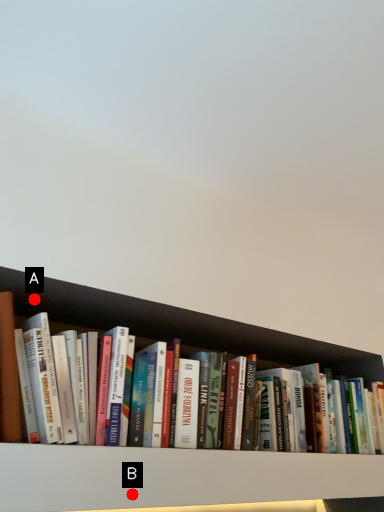
Question: Two points are circled on the image, labeled by A and B beside each circle. Which of the following is the closest to the observer?

Choices:
 (A) A is closer
 (B) B is closer

Answer: (B)